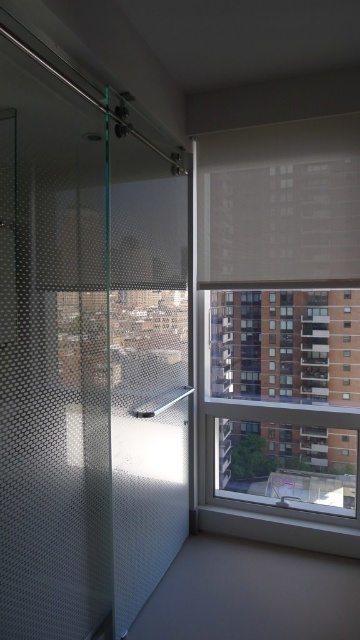
Is point (169, 499) more distant than point (249, 380)?

No, it is not.

Can you confirm if frosted glass door at left is taller than clear glass window at upper right?

Correct, frosted glass door at left is much taller as clear glass window at upper right.

Which is in front, point (99, 444) or point (262, 394)?

Positioned in front is point (99, 444).

You are a GUI agent. You are given a task and a screenshot of the screen. Output one action in this format:
    pyautogui.click(x=<x>, y=<y>)
    Task: Click on the frosted glass door at left
    
    Given the screenshot: What is the action you would take?
    pyautogui.click(x=86, y=349)

Does point (46, 534) come farther from viewer compared to point (298, 172)?

No.

The height and width of the screenshot is (640, 360). What do you see at coordinates (86, 349) in the screenshot?
I see `frosted glass door at left` at bounding box center [86, 349].

Locate an element on the screen. frosted glass door at left is located at coordinates (86, 349).

Does clear glass window at upper right have a larger size compared to white matte blind at upper center?

Yes, clear glass window at upper right is bigger than white matte blind at upper center.

Is clear glass window at upper right taller than white matte blind at upper center?

Correct, clear glass window at upper right is much taller as white matte blind at upper center.

Who is more distant from viewer, (342, 433) or (222, 256)?

Positioned behind is point (222, 256).

Image resolution: width=360 pixels, height=640 pixels. Identify the location of clear glass window at upper right. (285, 346).